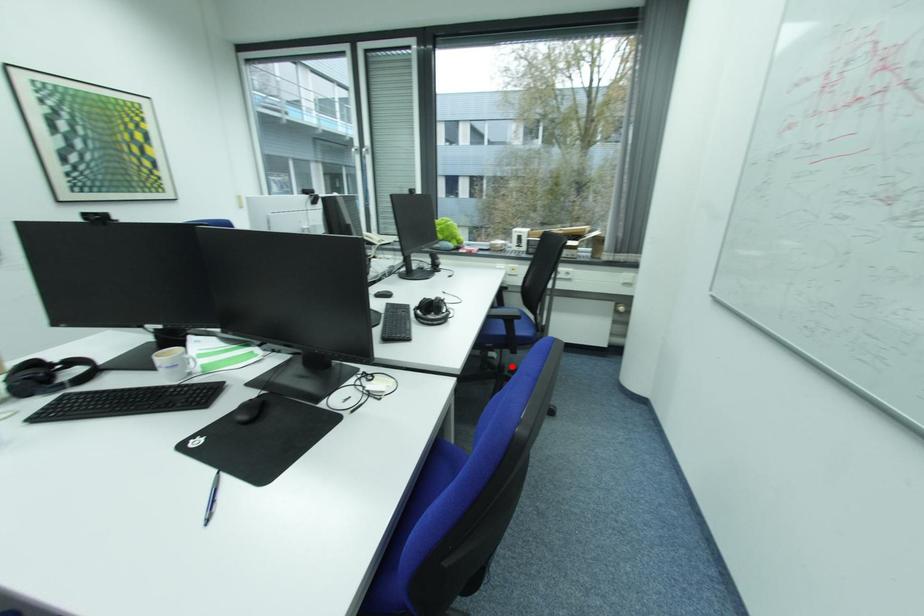
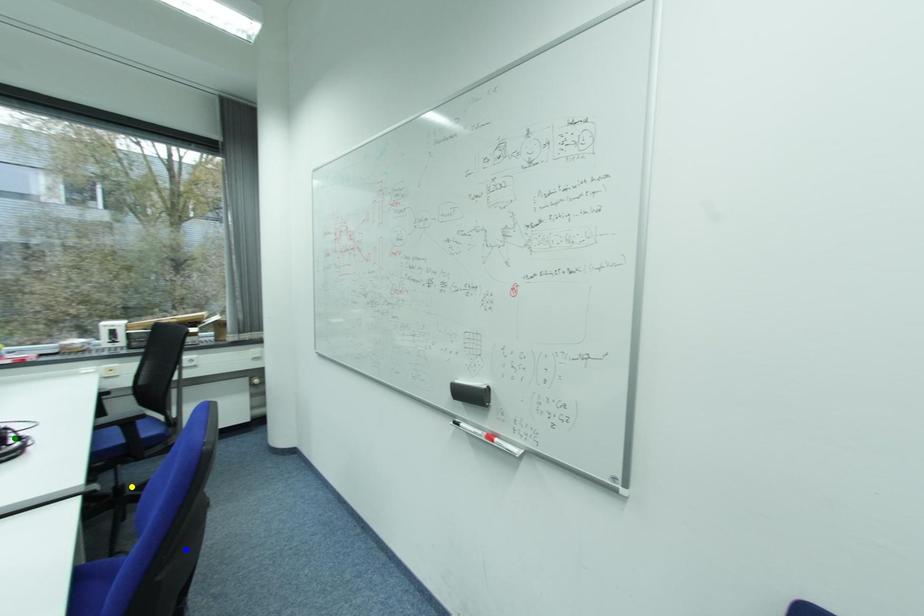
Question: I am providing you with two images of the same scene from different viewpoints. A red point is marked on the first image. You are given multiple points on the second image. Can you choose the point in image 2 that corresponds to the point in image 1?

Choices:
 (A) blue point
 (B) green point
 (C) yellow point

Answer: (C)